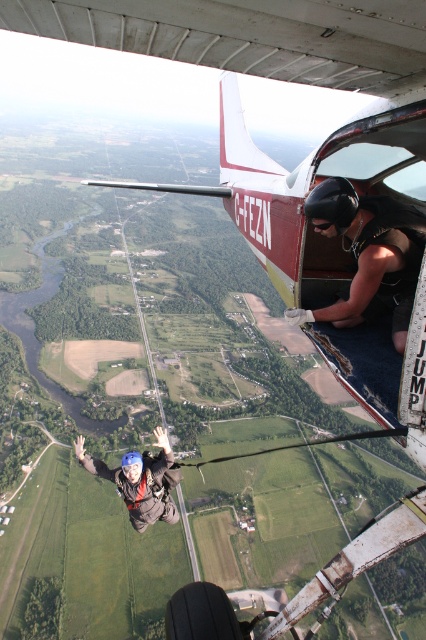
Question: Which object is closer to the camera taking this photo?

Choices:
 (A) blue helmeted skydiver at center
 (B) black matte helmet at upper right

Answer: (B)

Question: Among these objects, which one is farthest from the camera?

Choices:
 (A) blue helmeted skydiver at center
 (B) black matte helmet at upper right

Answer: (A)

Question: Can you confirm if black matte helmet at upper right is positioned below blue helmeted skydiver at center?

Choices:
 (A) yes
 (B) no

Answer: (B)

Question: Can you confirm if black matte helmet at upper right is positioned to the right of blue helmeted skydiver at center?

Choices:
 (A) no
 (B) yes

Answer: (B)

Question: Does black matte helmet at upper right appear on the left side of blue helmeted skydiver at center?

Choices:
 (A) yes
 (B) no

Answer: (B)

Question: Which of the following is the closest to the observer?

Choices:
 (A) (123, 465)
 (B) (363, 202)

Answer: (B)